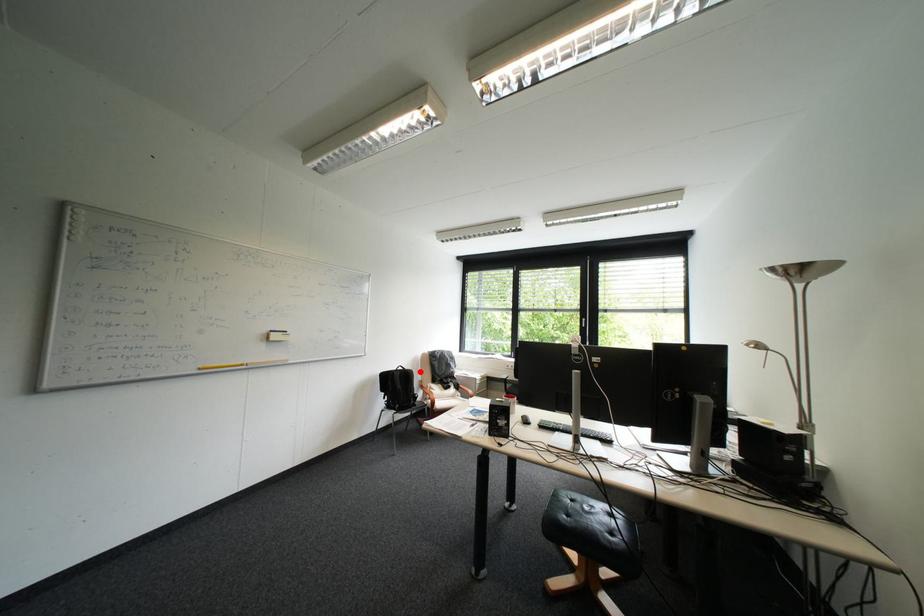
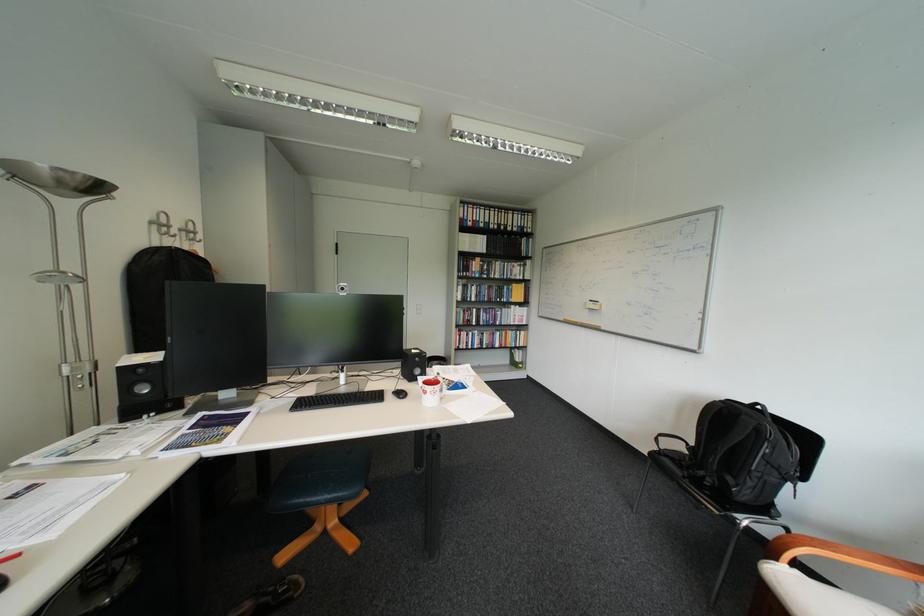
The point at the highlighted location is marked in the first image. Where is the corresponding point in the second image?

(756, 418)